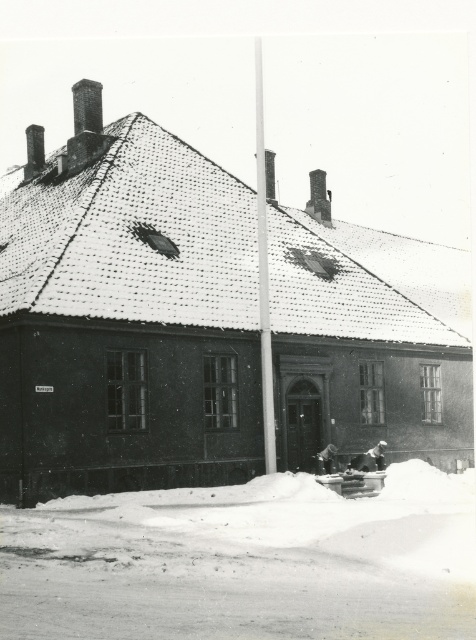
Is white powdery snow at lower center in front of smooth white pole at center?

Yes, it is.

I want to click on white powdery snow at lower center, so click(246, 563).